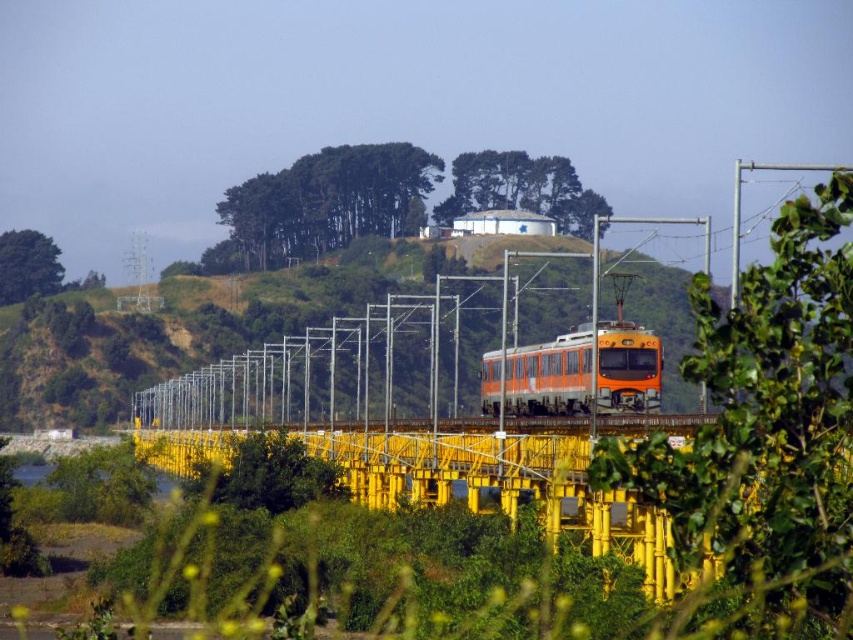
Does green grassy hillside at center appear under orange metallic pole at center?

Indeed, green grassy hillside at center is positioned under orange metallic pole at center.

Does point (469, 301) lie behind point (596, 410)?

Yes.

Who is more distant from viewer, (x=27, y=348) or (x=595, y=275)?

The point (x=27, y=348) is behind.

You are a GUI agent. You are given a task and a screenshot of the screen. Output one action in this format:
    pyautogui.click(x=<x>, y=<y>)
    Task: Click on the green grassy hillside at center
    The height and width of the screenshot is (640, 853).
    Given the screenshot: What is the action you would take?
    pyautogui.click(x=195, y=324)

Looking at this image, which of these two, green leafy trees at upper center or orange metallic pole at center, stands taller?

green leafy trees at upper center is taller.

Does point (252, 243) lie behind point (589, 404)?

Yes, it is.

Between point (329, 147) and point (595, 406), which one is positioned behind?

Positioned behind is point (329, 147).

At what (x,y) coordinates should I click in order to perform the action: click on green leafy trees at upper center. Please return your answer as a coordinate pair (x, y). Looking at the image, I should click on (323, 204).

Is green textured water tower at center wider than green leafy tree at upper left?

Correct, the width of green textured water tower at center exceeds that of green leafy tree at upper left.

I want to click on green textured water tower at center, so click(x=521, y=189).

You are a GUI agent. You are given a task and a screenshot of the screen. Output one action in this format:
    pyautogui.click(x=<x>, y=<y>)
    Task: Click on the green textured water tower at center
    The height and width of the screenshot is (640, 853).
    Given the screenshot: What is the action you would take?
    pyautogui.click(x=521, y=189)